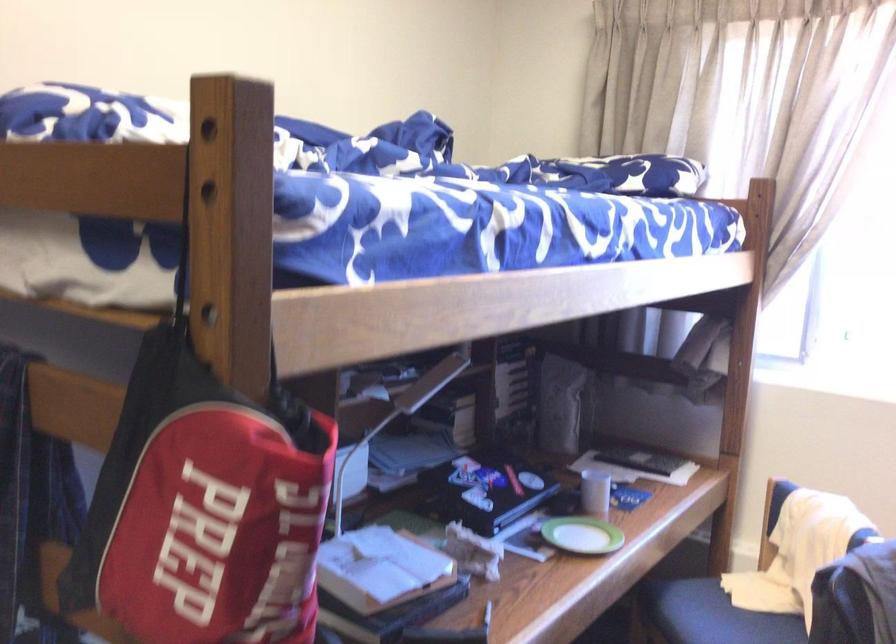
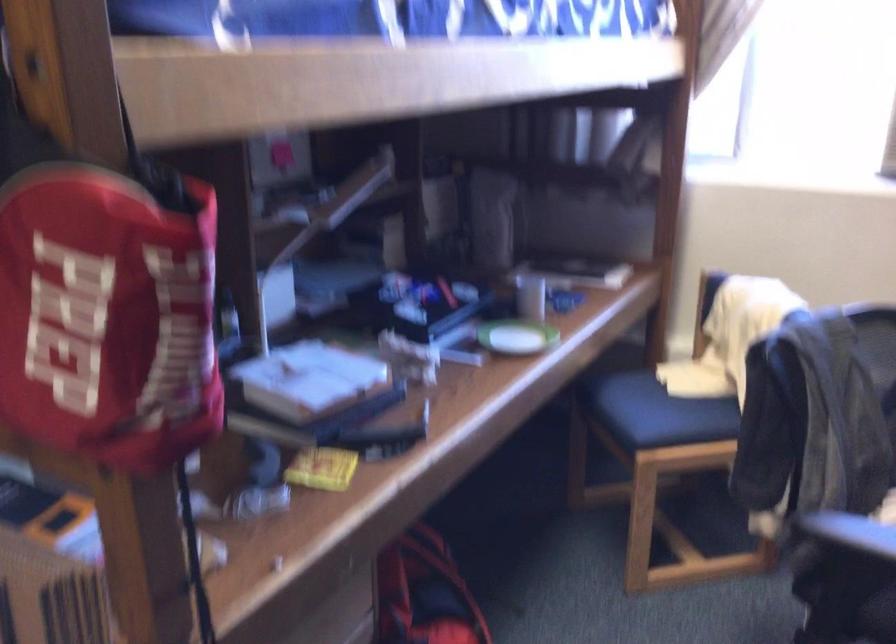
In the second image, find the point that corresponds to (x=226, y=545) in the first image.

(107, 317)